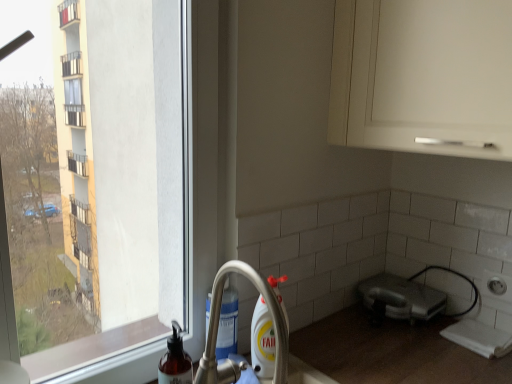
Question: Does translucent plastic soap dispenser at lower left have a greater height compared to silver metallic faucet at lower center?

Choices:
 (A) no
 (B) yes

Answer: (A)

Question: Considering the relative positions of translucent plastic soap dispenser at lower left and silver metallic faucet at lower center in the image provided, is translucent plastic soap dispenser at lower left to the left of silver metallic faucet at lower center from the viewer's perspective?

Choices:
 (A) yes
 (B) no

Answer: (A)

Question: Is translucent plastic soap dispenser at lower left smaller than silver metallic faucet at lower center?

Choices:
 (A) yes
 (B) no

Answer: (A)

Question: From a real-world perspective, is translucent plastic soap dispenser at lower left physically below silver metallic faucet at lower center?

Choices:
 (A) no
 (B) yes

Answer: (B)

Question: Is translucent plastic soap dispenser at lower left facing towards silver metallic faucet at lower center?

Choices:
 (A) no
 (B) yes

Answer: (A)

Question: From the image's perspective, is silver metallic faucet at lower center above or below satin silver toaster at lower right?

Choices:
 (A) below
 (B) above

Answer: (B)

Question: In the image, is silver metallic faucet at lower center positioned in front of or behind satin silver toaster at lower right?

Choices:
 (A) behind
 (B) front

Answer: (B)

Question: In terms of size, does silver metallic faucet at lower center appear bigger or smaller than satin silver toaster at lower right?

Choices:
 (A) small
 (B) big

Answer: (B)

Question: From a real-world perspective, is silver metallic faucet at lower center above or below satin silver toaster at lower right?

Choices:
 (A) below
 (B) above

Answer: (B)

Question: From the image's perspective, is satin silver toaster at lower right above or below silver metallic faucet at lower center?

Choices:
 (A) below
 (B) above

Answer: (A)

Question: From a real-world perspective, is satin silver toaster at lower right above or below silver metallic faucet at lower center?

Choices:
 (A) above
 (B) below

Answer: (B)

Question: In the image, is satin silver toaster at lower right on the left side or the right side of silver metallic faucet at lower center?

Choices:
 (A) left
 (B) right

Answer: (B)

Question: In terms of height, does satin silver toaster at lower right look taller or shorter compared to silver metallic faucet at lower center?

Choices:
 (A) short
 (B) tall

Answer: (A)

Question: Is translucent plastic soap dispenser at lower left bigger or smaller than satin silver toaster at lower right?

Choices:
 (A) small
 (B) big

Answer: (A)

Question: Is translucent plastic soap dispenser at lower left inside the boundaries of satin silver toaster at lower right, or outside?

Choices:
 (A) inside
 (B) outside

Answer: (B)